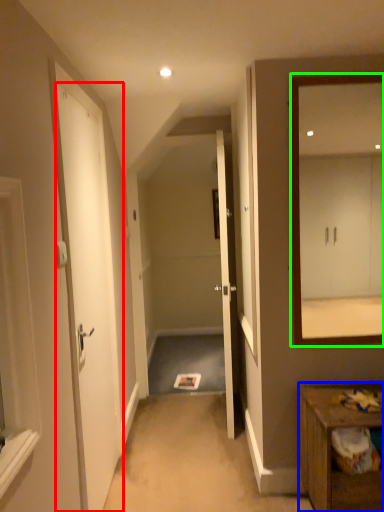
Question: Estimate the real-world distances between objects in this image. Which object is closer to door (highlighted by a red box), table (highlighted by a blue box) or mirror (highlighted by a green box)?

Choices:
 (A) table
 (B) mirror

Answer: (A)